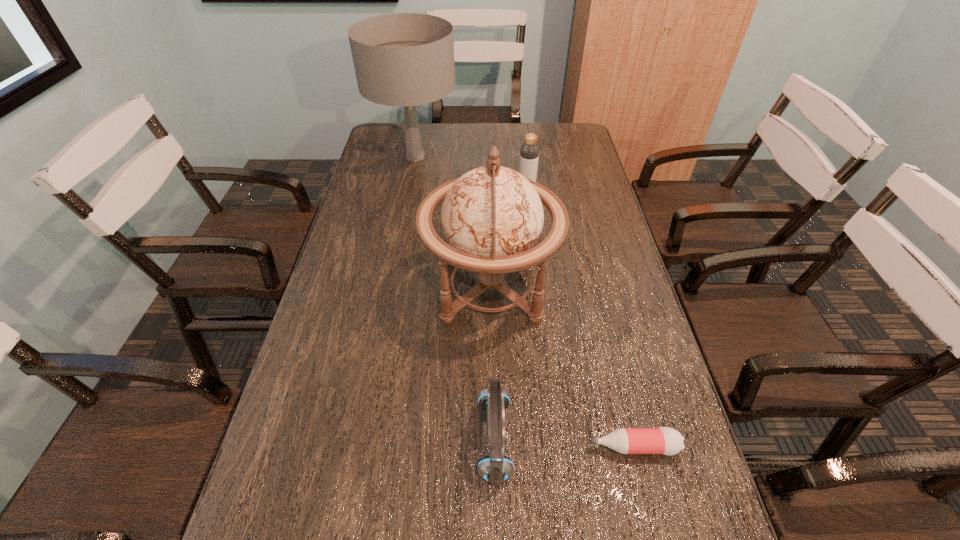
Locate an element on the screen. The width and height of the screenshot is (960, 540). object that is at the right edge is located at coordinates (664, 440).

Image resolution: width=960 pixels, height=540 pixels. Find the location of `object located at the far left corner`. object located at the far left corner is located at coordinates (403, 59).

I want to click on free space at the far edge, so 443,141.

Where is `vacant space at the left edge of the desktop`? The image size is (960, 540). vacant space at the left edge of the desktop is located at coordinates (354, 437).

In the image, there is a desktop. Where is `free space at the right edge`? This screenshot has width=960, height=540. free space at the right edge is located at coordinates (620, 268).

Identify the location of free space between the second shortest object and the taller bottle. (510, 316).

Locate an element on the screen. Image resolution: width=960 pixels, height=540 pixels. vacant area that lies between the shortest object and the third farthest object is located at coordinates (562, 367).

I want to click on vacant space in between the nearer bottle and the left bottle, so click(580, 320).

Identify which object is the fourth closest to the shorter bottle. Please provide its 2D coordinates. Your answer should be formatted as a tuple, i.e. [(x, y)], where the tuple contains the x and y coordinates of a point satisfying the conditions above.

[(403, 59)]

The height and width of the screenshot is (540, 960). In order to click on the closest object to the second shortest object in this screenshot , I will do click(x=492, y=217).